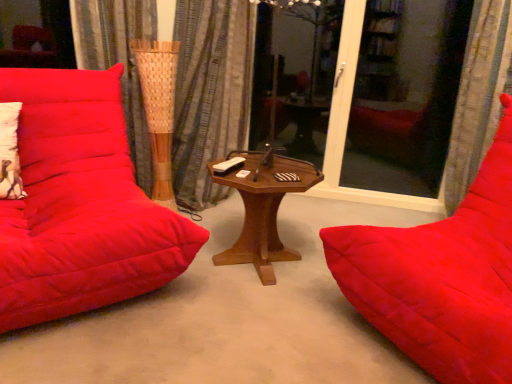
The width and height of the screenshot is (512, 384). In order to click on vacant area situated below wooden hexagonal table at center (from a real-world perspective) in this screenshot , I will do `click(256, 271)`.